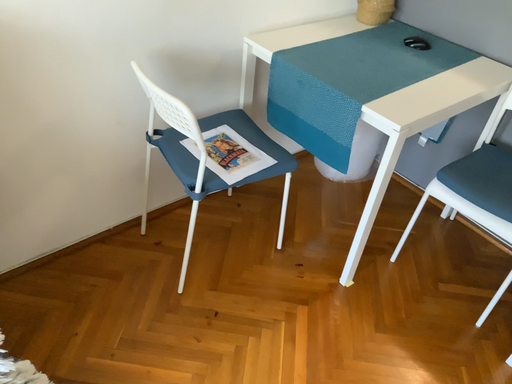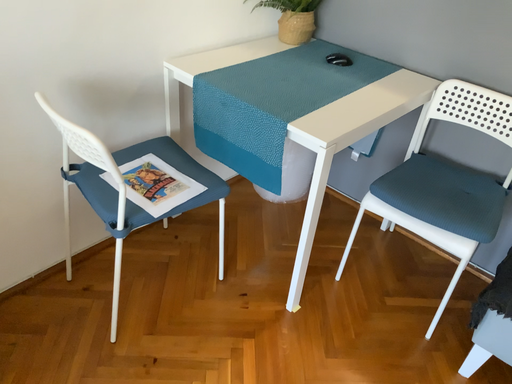
Question: How did the camera likely rotate when shooting the video?

Choices:
 (A) rotated left
 (B) rotated right

Answer: (B)